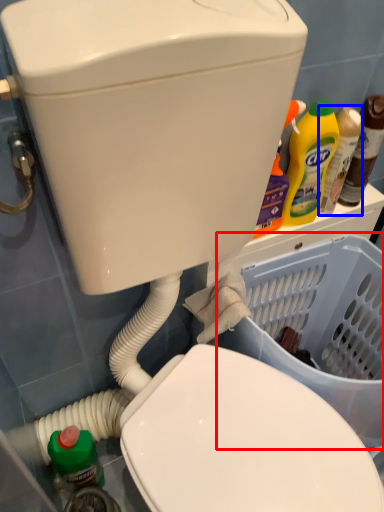
Question: Which of the following is the farthest to the observer, basket container (highlighted by a red box) or bottle (highlighted by a blue box)?

Choices:
 (A) basket container
 (B) bottle

Answer: (B)